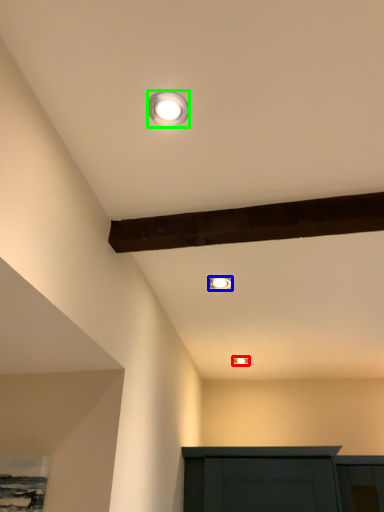
Question: Which object is positioned closest to lamp (highlighted by a red box)? Select from lamp (highlighted by a blue box) and lamp (highlighted by a green box).

Choices:
 (A) lamp
 (B) lamp

Answer: (A)